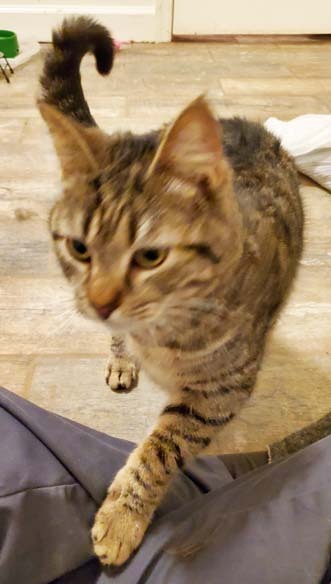
Where is `empty space under door and the floor`? empty space under door and the floor is located at coordinates (266, 37).